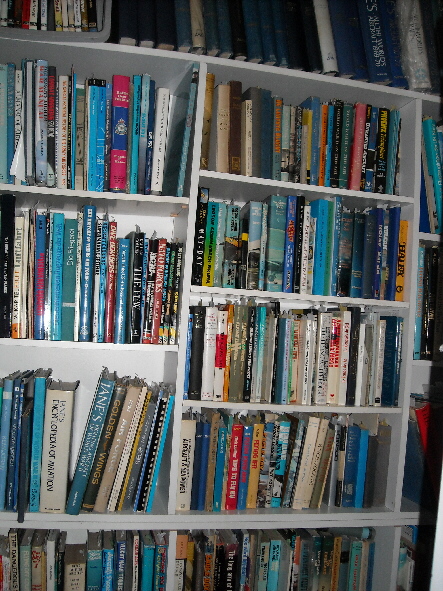
Find the location of a particular element. This screenshot has width=443, height=591. blue book is located at coordinates (362, 459), (243, 492), (204, 486), (272, 571), (397, 366), (394, 284), (324, 238).